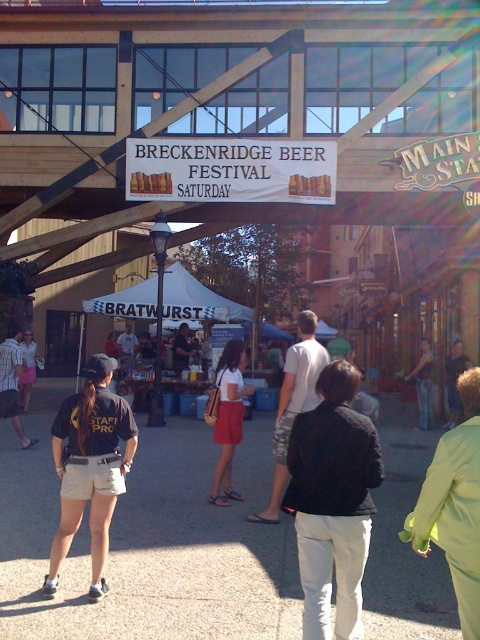
Between white fabric canopy at center and matte white shirt at center, which one is positioned higher?

white fabric canopy at center is higher up.

Is white fabric canopy at center thinner than matte white shirt at center?

No, white fabric canopy at center is not thinner than matte white shirt at center.

Find the location of a particular element. Image resolution: width=480 pixels, height=640 pixels. white fabric canopy at center is located at coordinates (196, 300).

Does camouflage shorts at center have a lesser height compared to black shirt at left?

In fact, camouflage shorts at center may be taller than black shirt at left.

Who is more forward, (312, 364) or (33, 368)?

Point (312, 364) is in front.

Is point (287, 360) farther from camera compared to point (22, 372)?

That is False.

This screenshot has width=480, height=640. I want to click on camouflage shorts at center, so click(292, 403).

Between point (107, 481) and point (418, 387), which one is positioned behind?

Point (418, 387)

Is black cotton t-shirt at left taller than denim pants at center?

No, black cotton t-shirt at left is not taller than denim pants at center.

Where is `black cotton t-shirt at left`? black cotton t-shirt at left is located at coordinates (90, 467).

Where is `black cotton t-shirt at left`? This screenshot has width=480, height=640. black cotton t-shirt at left is located at coordinates (90, 467).